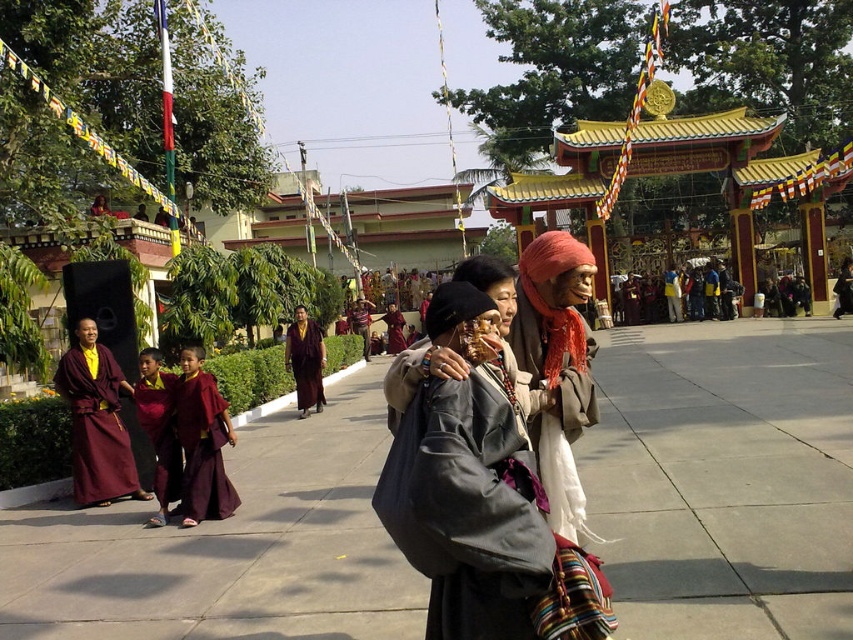
You are a visitor at the temple and want to greet both monks. The gray woolen robe at center and the maroon silk robe at left are in your view. Which monk should you approach first if you want to greet them in the order they appear from left to right?

The maroon silk robe at left is on the left side, so you should greet the maroon silk robe at left first, followed by the gray woolen robe at center which is to the right of it.

You are standing in the temple courtyard and need to locate the gray woolen robe at center. Based on the coordinates provided, where would you find it in the image?

The gray woolen robe at center is located at the 2D coordinates point (463, 506) in the image.

You are a photographer planning to capture a group photo of the gray woolen robe at center and the maroon silk robe at left. Considering their sizes, which robe should you position closer to the camera to ensure both appear proportionally sized in the photo?

The gray woolen robe at center is wider than the maroon silk robe at left. To ensure both appear proportionally sized in the photo, position the wider gray woolen robe at center slightly farther from the camera compared to the narrower maroon silk robe at left. This adjustment will help balance their sizes in the final image.